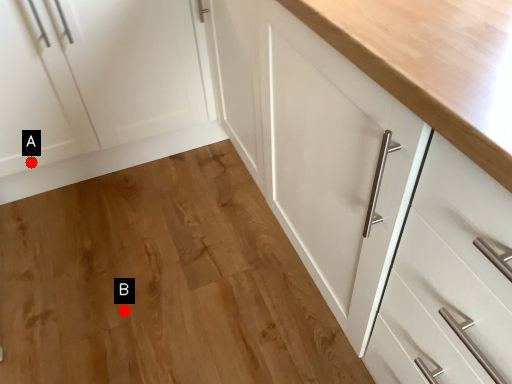
Question: Two points are circled on the image, labeled by A and B beside each circle. Which point is closer to the camera taking this photo?

Choices:
 (A) A is closer
 (B) B is closer

Answer: (B)